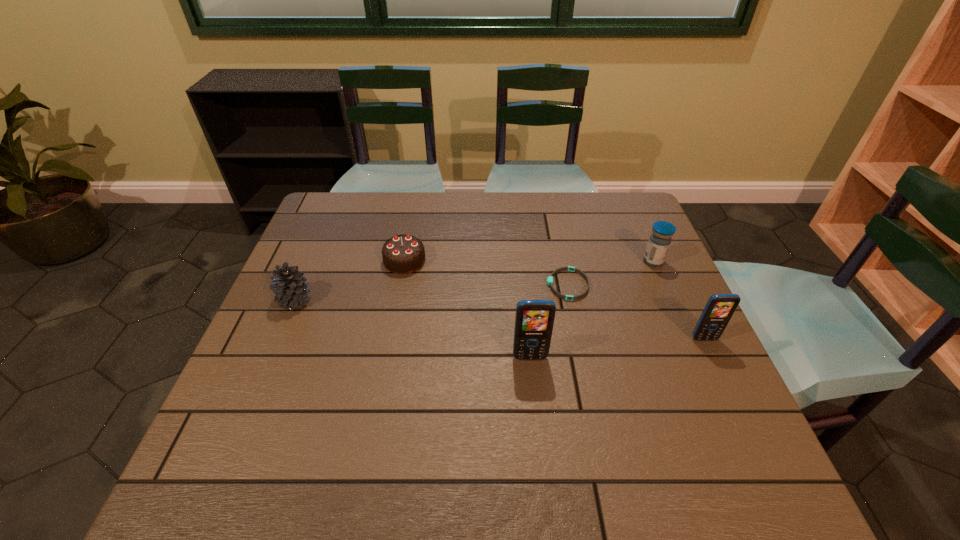
With all cellular telephones evenly spaced, where should an extra cellular telephone be placed on the left to continue the pattern? Please point out a vacant space. Please provide its 2D coordinates. Your answer should be formatted as a tuple, i.e. [(x, y)], where the tuple contains the x and y coordinates of a point satisfying the conditions above.

[(342, 377)]